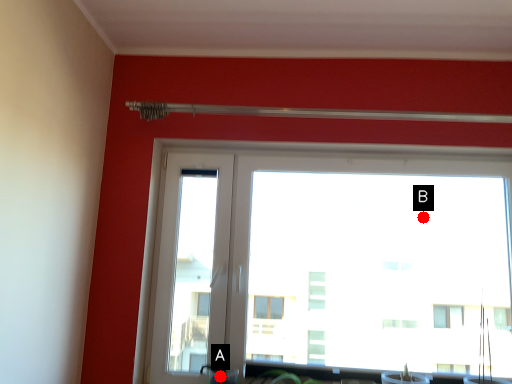
Question: Two points are circled on the image, labeled by A and B beside each circle. Which point is farther from the camera taking this photo?

Choices:
 (A) A is further
 (B) B is further

Answer: (B)